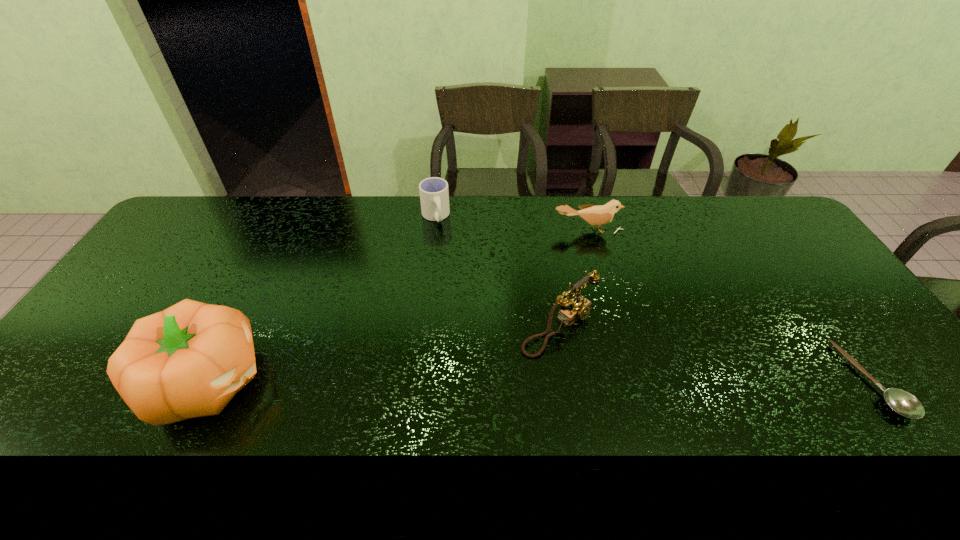
The height and width of the screenshot is (540, 960). In order to click on the leftmost object in this screenshot , I will do `click(189, 360)`.

Identify the location of pumpkin. (189, 360).

This screenshot has height=540, width=960. I want to click on the shortest object, so click(x=903, y=403).

You are a GUI agent. You are given a task and a screenshot of the screen. Output one action in this format:
    pyautogui.click(x=<x>, y=<y>)
    Task: Click on the ladle
    The height and width of the screenshot is (540, 960).
    Given the screenshot: What is the action you would take?
    pyautogui.click(x=903, y=403)

This screenshot has height=540, width=960. In order to click on cup in this screenshot , I will do `click(434, 196)`.

At what (x,y) coordinates should I click in order to perform the action: click on telephone. Please return your answer as a coordinate pair (x, y). This screenshot has height=540, width=960. Looking at the image, I should click on (578, 307).

Identify the location of bird. The width and height of the screenshot is (960, 540). (600, 215).

The height and width of the screenshot is (540, 960). I want to click on vacant region located 0.260m on the carved face of the tallest object, so click(372, 381).

Locate an element on the screen. The image size is (960, 540). vacant point located 0.270m on the back of the rightmost object is located at coordinates (795, 272).

The height and width of the screenshot is (540, 960). Find the location of `vacant space positioned 0.210m with the handle on the side of the fourth object from right to left`. vacant space positioned 0.210m with the handle on the side of the fourth object from right to left is located at coordinates pos(447,271).